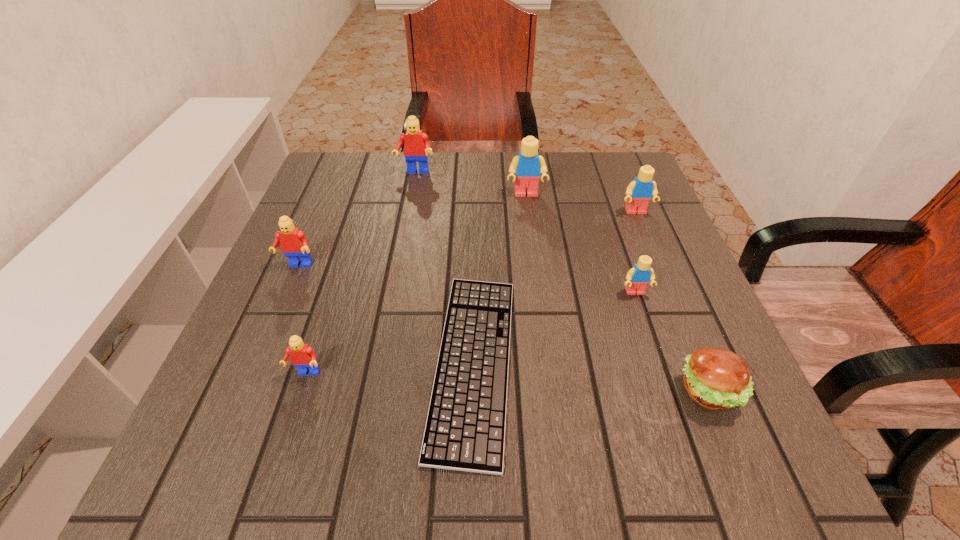
I want to click on vacant space at the near left corner of the desktop, so coord(274,433).

Locate an element on the screen. Image resolution: width=960 pixels, height=540 pixels. free location at the far right corner of the desktop is located at coordinates (582, 163).

At what (x,y) coordinates should I click in order to perform the action: click on free space at the near right corner of the desktop. Please return your answer as a coordinate pair (x, y). The height and width of the screenshot is (540, 960). Looking at the image, I should click on (746, 438).

Locate an element on the screen. empty location between the third object from left to right and the seventh object from right to left is located at coordinates (361, 273).

This screenshot has height=540, width=960. Find the location of `blank region between the hamburger and the smallest yellow Lego`. blank region between the hamburger and the smallest yellow Lego is located at coordinates (672, 342).

Locate an element on the screen. The image size is (960, 540). free spot between the shortest object and the seventh object from right to left is located at coordinates (390, 368).

At what (x,y) coordinates should I click in order to perform the action: click on vacant point located between the black computer keyboard and the fourth Lego from left to right. Please return your answer as a coordinate pair (x, y). Looking at the image, I should click on (500, 278).

You are a GUI agent. You are given a task and a screenshot of the screen. Output one action in this format:
    pyautogui.click(x=<x>, y=<y>)
    Task: Click on the free space between the fourth farthest object and the second red Lego from left to right
    Image resolution: width=960 pixels, height=540 pixels.
    Given the screenshot: What is the action you would take?
    pyautogui.click(x=302, y=320)

Locate an element on the screen. free spot between the black computer keyboard and the third Lego from right to left is located at coordinates (500, 278).

You are a GUI agent. You are given a task and a screenshot of the screen. Output one action in this format:
    pyautogui.click(x=<x>, y=<y>)
    Task: Click on the vacant space that's between the nearest yellow Lego and the rightmost red Lego
    
    Given the screenshot: What is the action you would take?
    pyautogui.click(x=525, y=233)